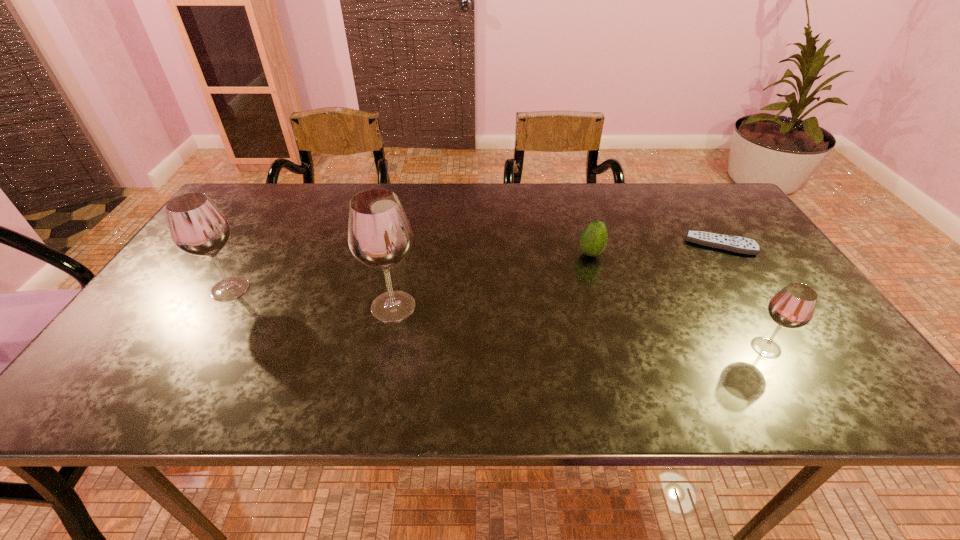
Identify the location of vacant space at the left edge of the desktop. (156, 317).

Image resolution: width=960 pixels, height=540 pixels. Identify the location of vacant area at the right edge. (768, 331).

Where is `vacant region at the far left corner of the desktop`? vacant region at the far left corner of the desktop is located at coordinates (233, 205).

At what (x,y) coordinates should I click in order to perform the action: click on vacant region at the near left corner of the desktop. Please return your answer as a coordinate pair (x, y). Looking at the image, I should click on (145, 354).

Locate an element on the screen. This screenshot has width=960, height=540. vacant space that is in between the second object from left to right and the second tallest object is located at coordinates click(x=312, y=298).

What are the coordinates of `free point between the second object from left to right and the third tallest object` in the screenshot? It's located at (580, 327).

Where is `free area in between the second object from left to right and the third object from left to right`? The width and height of the screenshot is (960, 540). free area in between the second object from left to right and the third object from left to right is located at coordinates (492, 280).

Select which object appears as the second closest to the avocado. Please provide its 2D coordinates. Your answer should be formatted as a tuple, i.e. [(x, y)], where the tuple contains the x and y coordinates of a point satisfying the conditions above.

[(793, 306)]

Identify the location of the fourth closest object to the remote control. (197, 227).

Identify which wineglass is the nearest to the second wineglass from right to left. Please provide its 2D coordinates. Your answer should be formatted as a tuple, i.e. [(x, y)], where the tuple contains the x and y coordinates of a point satisfying the conditions above.

[(197, 227)]